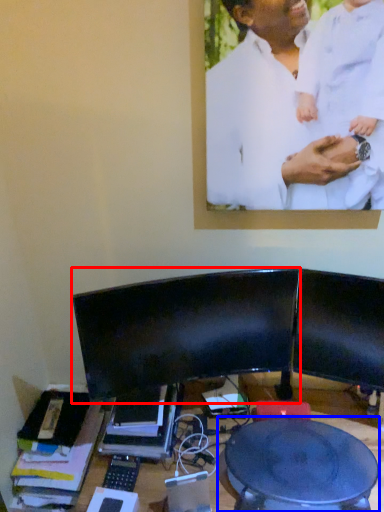
Question: Among these objects, which one is nearest to the camera, computer monitor (highlighted by a red box) or round table (highlighted by a blue box)?

Choices:
 (A) computer monitor
 (B) round table

Answer: (B)